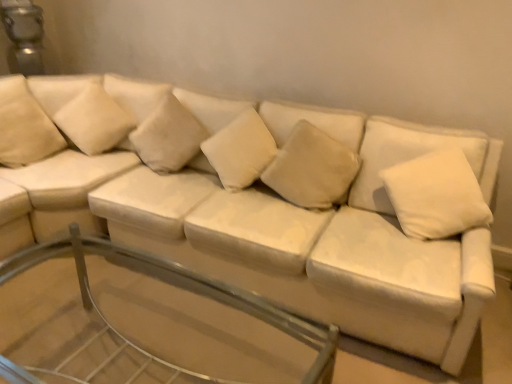
Describe the element at coordinates (312, 168) in the screenshot. I see `suede-like beige pillow at center, which ranks as the 5th pillow in left-to-right order` at that location.

Identify the location of beige fabric pillow at center, the fourth pillow viewed from the right. The height and width of the screenshot is (384, 512). (168, 136).

The width and height of the screenshot is (512, 384). Describe the element at coordinates (240, 150) in the screenshot. I see `white soft cushion at center, which ranks as the fourth pillow in left-to-right order` at that location.

Find the location of a particular element. This screenshot has width=512, height=384. suede-like beige pillow at center, the 2th pillow when ordered from right to left is located at coordinates (312, 168).

Does white soft cushion at center, which ranks as the fourth pillow in left-to-right order, have a greater height compared to suede-like beige pillow at center, which ranks as the 5th pillow in left-to-right order?

No.

Would you say white soft cushion at center, placed as the 3th pillow when sorted from right to left, contains suede-like beige pillow at center, the 2th pillow when ordered from right to left?

Actually, suede-like beige pillow at center, the 2th pillow when ordered from right to left, is outside white soft cushion at center, placed as the 3th pillow when sorted from right to left.

Based on the photo, can you confirm if white soft cushion at center, placed as the 3th pillow when sorted from right to left, is smaller than suede-like beige pillow at center, the 2th pillow when ordered from right to left?

Actually, white soft cushion at center, placed as the 3th pillow when sorted from right to left, might be larger than suede-like beige pillow at center, the 2th pillow when ordered from right to left.

From the picture: From a real-world perspective, who is located lower, white soft cushion at center, placed as the 3th pillow when sorted from right to left, or suede-like beige pillow at center, which ranks as the 5th pillow in left-to-right order?

suede-like beige pillow at center, which ranks as the 5th pillow in left-to-right order, from a real-world perspective.

From the image's perspective, is suede-like beige pillow at upper left, which is the 6th pillow in right-to-left order, located beneath transparent glass table at center?

No, from the image's perspective, suede-like beige pillow at upper left, which is the 6th pillow in right-to-left order, is not beneath transparent glass table at center.

Considering the relative positions of suede-like beige pillow at upper left, which is the 6th pillow in right-to-left order, and transparent glass table at center in the image provided, is suede-like beige pillow at upper left, which is the 6th pillow in right-to-left order, to the left of transparent glass table at center from the viewer's perspective?

Yes.

Considering the positions of objects suede-like beige pillow at upper left, the 1th pillow when ordered from left to right, and transparent glass table at center in the image provided, who is behind, suede-like beige pillow at upper left, the 1th pillow when ordered from left to right, or transparent glass table at center?

suede-like beige pillow at upper left, the 1th pillow when ordered from left to right, is more distant.

Is suede-like beige pillow at upper left, the 1th pillow when ordered from left to right, wider than transparent glass table at center?

Incorrect, the width of suede-like beige pillow at upper left, the 1th pillow when ordered from left to right, does not surpass that of transparent glass table at center.

Considering the sizes of white soft cushion at upper left, marked as the second pillow in a left-to-right arrangement, and transparent glass table at center in the image, is white soft cushion at upper left, marked as the second pillow in a left-to-right arrangement, taller or shorter than transparent glass table at center?

In the image, white soft cushion at upper left, marked as the second pillow in a left-to-right arrangement, appears to be shorter than transparent glass table at center.

From a real-world perspective, is white soft cushion at upper left, marked as the second pillow in a left-to-right arrangement, positioned under transparent glass table at center based on gravity?

Actually, white soft cushion at upper left, marked as the second pillow in a left-to-right arrangement, is physically above transparent glass table at center in the real world.

How distant is white soft cushion at upper left, marked as the second pillow in a left-to-right arrangement, from transparent glass table at center?

white soft cushion at upper left, marked as the second pillow in a left-to-right arrangement, and transparent glass table at center are 3.29 feet apart.

Who is smaller, white soft cushion at upper left, marked as the second pillow in a left-to-right arrangement, or transparent glass table at center?

white soft cushion at upper left, marked as the second pillow in a left-to-right arrangement.

What are the coordinates of `the 2nd pillow directly above the suede-like beige pillow at upper left, which is the 6th pillow in right-to-left order (from a real-world perspective)` in the screenshot? It's located at (312, 168).

Would you say suede-like beige pillow at center, which ranks as the 5th pillow in left-to-right order, is to the left or to the right of suede-like beige pillow at upper left, which is the 6th pillow in right-to-left order, in the picture?

suede-like beige pillow at center, which ranks as the 5th pillow in left-to-right order, is to the right of suede-like beige pillow at upper left, which is the 6th pillow in right-to-left order.

Considering the sizes of objects suede-like beige pillow at center, which ranks as the 5th pillow in left-to-right order, and suede-like beige pillow at upper left, which is the 6th pillow in right-to-left order, in the image provided, who is thinner, suede-like beige pillow at center, which ranks as the 5th pillow in left-to-right order, or suede-like beige pillow at upper left, which is the 6th pillow in right-to-left order,?

With smaller width is suede-like beige pillow at center, which ranks as the 5th pillow in left-to-right order.

From a real-world perspective, relative to suede-like beige pillow at upper left, which is the 6th pillow in right-to-left order, is suede-like beige pillow at center, which ranks as the 5th pillow in left-to-right order, vertically above or below?

suede-like beige pillow at center, which ranks as the 5th pillow in left-to-right order, is situated higher than suede-like beige pillow at upper left, which is the 6th pillow in right-to-left order, in the real world.

Image resolution: width=512 pixels, height=384 pixels. What are the coordinates of `the 3rd pillow to the left when counting from the transparent glass table at center` in the screenshot? It's located at (24, 126).

What's the angular difference between transparent glass table at center and suede-like beige pillow at upper left, which is the 6th pillow in right-to-left order,'s facing directions?

The facing directions of transparent glass table at center and suede-like beige pillow at upper left, which is the 6th pillow in right-to-left order, are 71.6 degrees apart.

Which point is more forward, (11, 379) or (38, 116)?

Point (11, 379)

From the picture: Can suede-like beige pillow at upper left, which is the 6th pillow in right-to-left order, be found inside transparent glass table at center?

No, suede-like beige pillow at upper left, which is the 6th pillow in right-to-left order, is not a part of transparent glass table at center.

Is white soft cushion at upper left, the 5th pillow viewed from the right, facing towards white soft cushion at center, placed as the 3th pillow when sorted from right to left?

No, white soft cushion at upper left, the 5th pillow viewed from the right, is not oriented towards white soft cushion at center, placed as the 3th pillow when sorted from right to left.

Which is more to the right, white soft cushion at upper left, marked as the second pillow in a left-to-right arrangement, or white soft cushion at center, which ranks as the fourth pillow in left-to-right order?

From the viewer's perspective, white soft cushion at center, which ranks as the fourth pillow in left-to-right order, appears more on the right side.

Is white soft cushion at upper left, the 5th pillow viewed from the right, taller or shorter than white soft cushion at center, which ranks as the fourth pillow in left-to-right order?

Considering their sizes, white soft cushion at upper left, the 5th pillow viewed from the right, has more height than white soft cushion at center, which ranks as the fourth pillow in left-to-right order.

Is white soft cushion at upper left, the 5th pillow viewed from the right, completely or partially inside transparent glass table at center?

No, white soft cushion at upper left, the 5th pillow viewed from the right, is not a part of transparent glass table at center.

From a real-world perspective, which object rests below the other?

transparent glass table at center, from a real-world perspective.

From the image's perspective, relative to white soft cushion at upper left, marked as the second pillow in a left-to-right arrangement, is transparent glass table at center above or below?

From the image's perspective, transparent glass table at center appears below white soft cushion at upper left, marked as the second pillow in a left-to-right arrangement.

Can you confirm if transparent glass table at center is positioned to the left of white soft cushion at upper left, marked as the second pillow in a left-to-right arrangement?

In fact, transparent glass table at center is to the right of white soft cushion at upper left, marked as the second pillow in a left-to-right arrangement.

The image size is (512, 384). What are the coordinates of `the 1st pillow below the white soft cushion at center, which ranks as the fourth pillow in left-to-right order (from the image's perspective)` in the screenshot? It's located at (312, 168).

Find the location of `the 5th pillow behind when counting from the transparent glass table at center`. the 5th pillow behind when counting from the transparent glass table at center is located at coordinates (24, 126).

Considering their positions, is white soft cushion at upper left, marked as the second pillow in a left-to-right arrangement, positioned further to suede-like beige pillow at upper left, the 1th pillow when ordered from left to right, than suede-like beige pillow at center, the 2th pillow when ordered from right to left?

suede-like beige pillow at center, the 2th pillow when ordered from right to left, is further to suede-like beige pillow at upper left, the 1th pillow when ordered from left to right.

When comparing their distances from beige fabric pillow at center, which ranks as the 3th pillow in left-to-right order, does suede-like beige pillow at upper left, the 1th pillow when ordered from left to right, or white soft cushion at upper left, the 5th pillow viewed from the right, seem closer?

white soft cushion at upper left, the 5th pillow viewed from the right, is closer to beige fabric pillow at center, which ranks as the 3th pillow in left-to-right order.

From the image, which object appears to be farther from suede-like beige pillow at upper left, the 1th pillow when ordered from left to right, white soft cushion at center, which ranks as the fourth pillow in left-to-right order, or transparent glass table at center?

The object further to suede-like beige pillow at upper left, the 1th pillow when ordered from left to right, is white soft cushion at center, which ranks as the fourth pillow in left-to-right order.

When comparing their distances from white soft cushion at center, which ranks as the fourth pillow in left-to-right order, does suede-like beige pillow at center, the 2th pillow when ordered from right to left, or suede-like beige pillow at upper left, the 1th pillow when ordered from left to right, seem further?

The object further to white soft cushion at center, which ranks as the fourth pillow in left-to-right order, is suede-like beige pillow at upper left, the 1th pillow when ordered from left to right.

Considering their positions, is transparent glass table at center positioned closer to suede-like beige pillow at center, the 2th pillow when ordered from right to left, than beige fabric pillow at center, the fourth pillow viewed from the right?

Based on the image, beige fabric pillow at center, the fourth pillow viewed from the right, appears to be nearer to suede-like beige pillow at center, the 2th pillow when ordered from right to left.

Based on their spatial positions, is white soft pillow at upper right, the 6th pillow viewed from the left, or beige fabric pillow at center, the fourth pillow viewed from the right, further from white soft cushion at center, placed as the 3th pillow when sorted from right to left?

Among the two, white soft pillow at upper right, the 6th pillow viewed from the left, is located further to white soft cushion at center, placed as the 3th pillow when sorted from right to left.

Which object lies nearer to the anchor point white soft pillow at upper right, the 6th pillow viewed from the left, suede-like beige pillow at upper left, which is the 6th pillow in right-to-left order, or suede-like beige pillow at center, which ranks as the 5th pillow in left-to-right order?

Based on the image, suede-like beige pillow at center, which ranks as the 5th pillow in left-to-right order, appears to be nearer to white soft pillow at upper right, the 6th pillow viewed from the left.

Which object lies further to the anchor point white soft cushion at center, placed as the 3th pillow when sorted from right to left, beige fabric pillow at center, which ranks as the 3th pillow in left-to-right order, or suede-like beige pillow at center, the 2th pillow when ordered from right to left?

The object further to white soft cushion at center, placed as the 3th pillow when sorted from right to left, is beige fabric pillow at center, which ranks as the 3th pillow in left-to-right order.

I want to click on pillow between white soft cushion at upper left, the 5th pillow viewed from the right, and white soft cushion at center, which ranks as the fourth pillow in left-to-right order, so click(x=168, y=136).

You are a GUI agent. You are given a task and a screenshot of the screen. Output one action in this format:
    pyautogui.click(x=<x>, y=<y>)
    Task: Click on the glass table between beige fabric pillow at center, which ranks as the 3th pillow in left-to-right order, and white soft pillow at upper right, acting as the 1th pillow starting from the right, in the horizontal direction
    The height and width of the screenshot is (384, 512).
    Given the screenshot: What is the action you would take?
    pyautogui.click(x=144, y=323)

At what (x,y) coordinates should I click in order to perform the action: click on glass table between white soft cushion at upper left, the 5th pillow viewed from the right, and white soft pillow at upper right, the 6th pillow viewed from the left, from left to right. Please return your answer as a coordinate pair (x, y). Looking at the image, I should click on (144, 323).

The image size is (512, 384). Identify the location of pillow between beige fabric pillow at center, which ranks as the 3th pillow in left-to-right order, and suede-like beige pillow at center, which ranks as the 5th pillow in left-to-right order, from left to right. (240, 150).